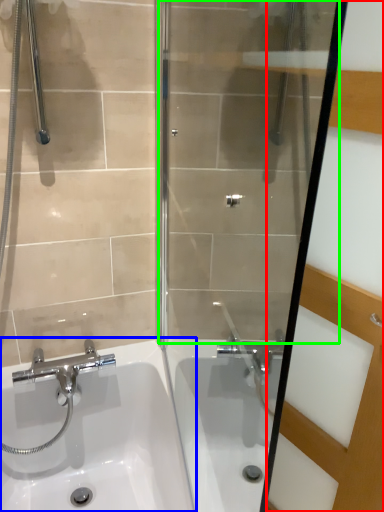
Question: Which is farther away from screen door (highlighted by a red box)? sink (highlighted by a blue box) or shower door (highlighted by a green box)?

Choices:
 (A) sink
 (B) shower door

Answer: (A)